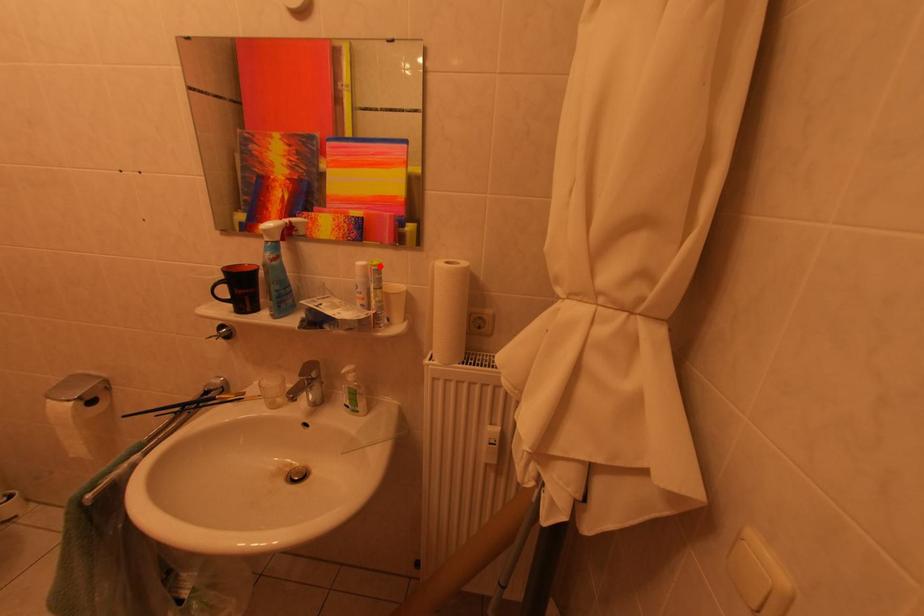
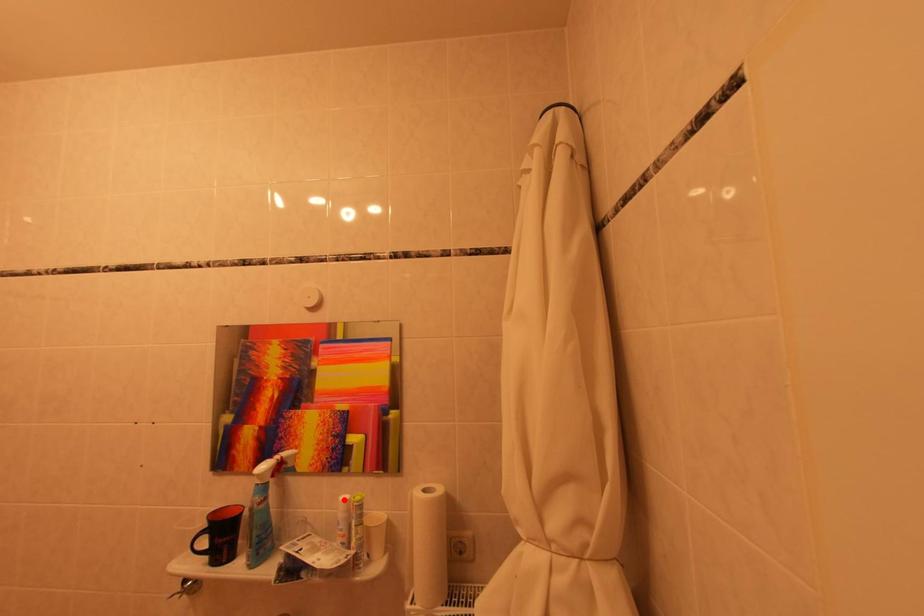
I am providing you with two images of the same scene from different viewpoints. A red point is marked on the first image and another point is marked on the second image. Is the marked point in image1 the same physical position as the marked point in image2?

No